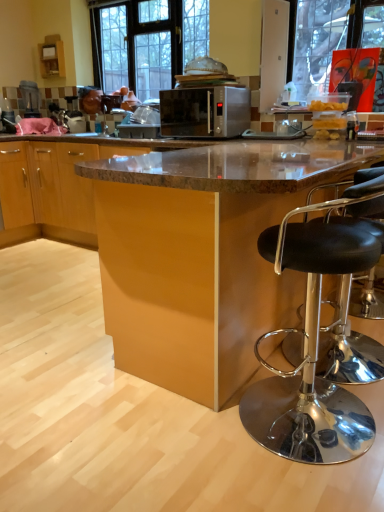
Identify the location of satin silver microwave at center. (205, 112).

Consider the image. What is the approximate height of black glass window at upper center?

black glass window at upper center is 1.01 meters in height.

Locate an element on the screen. The width and height of the screenshot is (384, 512). black leather stool at right is located at coordinates (311, 347).

This screenshot has width=384, height=512. I want to click on satin silver microwave at center, so click(x=205, y=112).

Which object is further away from the camera, satin silver microwave at center or black leather stool at right?

Positioned behind is satin silver microwave at center.

Is satin silver microwave at center situated inside black leather stool at right or outside?

satin silver microwave at center cannot be found inside black leather stool at right.

Consider the image. Is there a large distance between satin silver microwave at center and black leather stool at right?

Yes, satin silver microwave at center and black leather stool at right are located far from each other.

Is satin silver microwave at center looking in the opposite direction of black leather stool at right?

That's not correct — satin silver microwave at center is not looking away from black leather stool at right.

How distant is black glass window at upper center from black leather stool at right?

black glass window at upper center is 2.79 meters away from black leather stool at right.

Is black glass window at upper center turned away from black leather stool at right?

That's not correct — black glass window at upper center is not looking away from black leather stool at right.

Between black glass window at upper center and black leather stool at right, which one has less height?

With less height is black leather stool at right.

Is point (121, 11) more distant than point (320, 225)?

That is True.

Is black leather stool at right oriented away from black glass window at upper center?

No, black leather stool at right's orientation is not away from black glass window at upper center.

From the image's perspective, which object appears higher, black leather stool at right or black glass window at upper center?

From the image's view, black glass window at upper center is above.

How distant is black leather stool at right from black glass window at upper center?

They are 2.79 meters apart.

From the image's perspective, would you say black glass window at upper center is positioned over brown glossy table at center?

Yes, from the image's perspective, black glass window at upper center is over brown glossy table at center.

Between black glass window at upper center and brown glossy table at center, which one has larger width?

brown glossy table at center.

Is black glass window at upper center far away from brown glossy table at center?

black glass window at upper center is positioned a significant distance from brown glossy table at center.

Who is more distant, black glass window at upper center or brown glossy table at center?

black glass window at upper center is further away from the camera.

From a real-world perspective, which object stands above the other?

satin silver microwave at center, from a real-world perspective.

Is brown glossy table at center not near satin silver microwave at center?

brown glossy table at center is positioned a significant distance from satin silver microwave at center.

Which is nearer, (176, 345) or (180, 112)?

The point (176, 345) is closer.

Considering the sizes of objects brown glossy table at center and satin silver microwave at center in the image provided, who is shorter, brown glossy table at center or satin silver microwave at center?

With less height is satin silver microwave at center.

From a real-world perspective, is black leather stool at right positioned under brown glossy table at center based on gravity?

No, from a real-world perspective, black leather stool at right is not beneath brown glossy table at center.

From the image's perspective, which is below, black leather stool at right or brown glossy table at center?

black leather stool at right, from the image's perspective.

Is black leather stool at right facing away from brown glossy table at center?

Absolutely, black leather stool at right is directed away from brown glossy table at center.

Which is in front, black leather stool at right or brown glossy table at center?

black leather stool at right is in front.

Which is farther from the camera, (149, 33) or (192, 103)?

The point (149, 33) is farther.

Is black glass window at upper center shorter than satin silver microwave at center?

No.

Considering the sizes of black glass window at upper center and satin silver microwave at center in the image, is black glass window at upper center bigger or smaller than satin silver microwave at center?

In the image, black glass window at upper center appears to be larger than satin silver microwave at center.

In the image, there is a satin silver microwave at center. Where is `chair below it (from the image's perspective)`? This screenshot has width=384, height=512. chair below it (from the image's perspective) is located at coordinates (x=311, y=347).

Identify the location of chair directly beneath the black glass window at upper center (from a real-world perspective). (311, 347).

Which object lies nearer to the anchor point black glass window at upper center, brown glossy table at center or black leather stool at right?

brown glossy table at center lies closer to black glass window at upper center than the other object.

From the image, which object appears to be nearer to black leather stool at right, satin silver microwave at center or black glass window at upper center?

Based on the image, satin silver microwave at center appears to be nearer to black leather stool at right.

Looking at the image, which one is located further to brown glossy table at center, black glass window at upper center or black leather stool at right?

black glass window at upper center is positioned further to the anchor brown glossy table at center.

Which object lies further to the anchor point black leather stool at right, satin silver microwave at center or brown glossy table at center?

The object further to black leather stool at right is satin silver microwave at center.

Which object lies further to the anchor point brown glossy table at center, satin silver microwave at center or black leather stool at right?

Among the two, satin silver microwave at center is located further to brown glossy table at center.

Which object lies nearer to the anchor point brown glossy table at center, black leather stool at right or black glass window at upper center?

black leather stool at right is positioned closer to the anchor brown glossy table at center.

Based on their spatial positions, is brown glossy table at center or satin silver microwave at center closer to black leather stool at right?

Based on the image, brown glossy table at center appears to be nearer to black leather stool at right.

Considering their positions, is satin silver microwave at center positioned closer to brown glossy table at center than black glass window at upper center?

satin silver microwave at center is positioned closer to the anchor brown glossy table at center.

The height and width of the screenshot is (512, 384). Find the location of `microwave oven between black leather stool at right and black glass window at upper center from front to back`. microwave oven between black leather stool at right and black glass window at upper center from front to back is located at coordinates (205, 112).

Where is `table between black leather stool at right and black glass window at upper center from front to back`? The image size is (384, 512). table between black leather stool at right and black glass window at upper center from front to back is located at coordinates (203, 254).

At what (x,y) coordinates should I click in order to perform the action: click on table positioned between black leather stool at right and satin silver microwave at center from near to far. Please return your answer as a coordinate pair (x, y). This screenshot has height=512, width=384. Looking at the image, I should click on (203, 254).

The width and height of the screenshot is (384, 512). What are the coordinates of `microwave oven between brown glossy table at center and black glass window at upper center from front to back` in the screenshot? It's located at (205, 112).